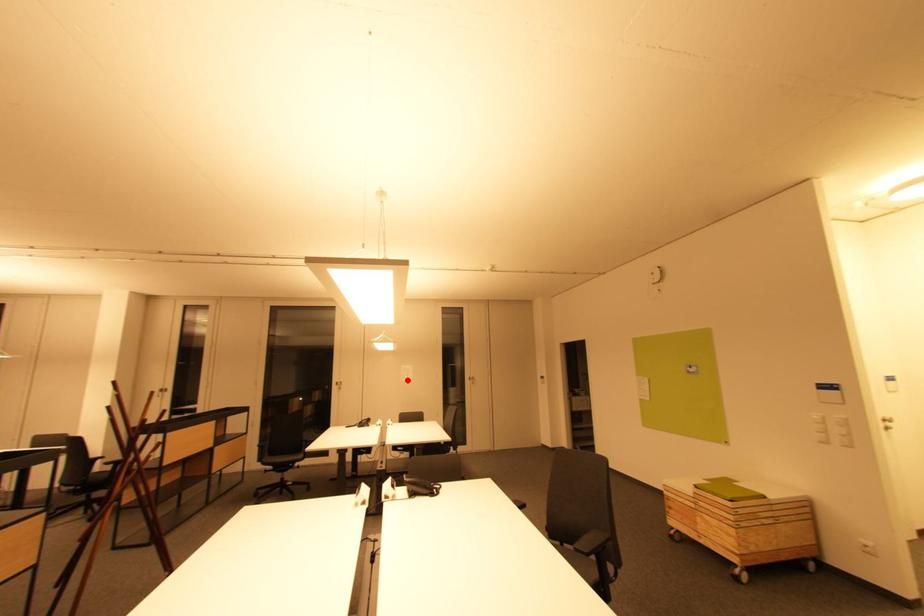
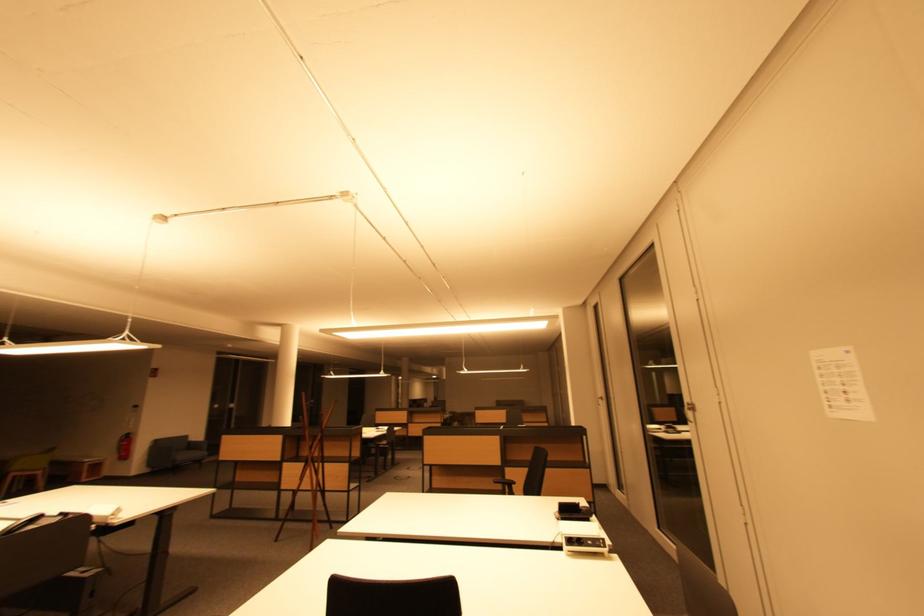
The point at the highlighted location is marked in the first image. Where is the corresponding point in the second image?

(834, 408)